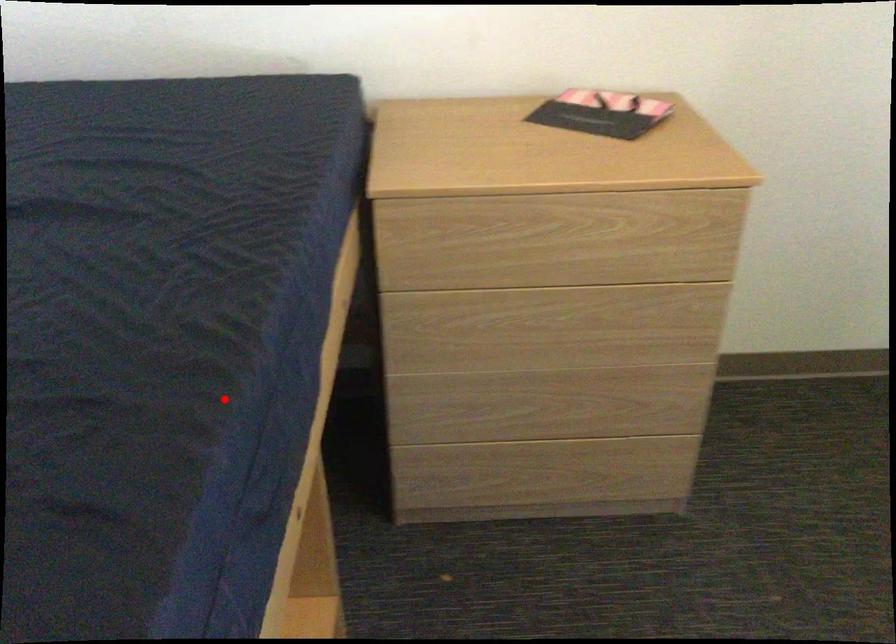
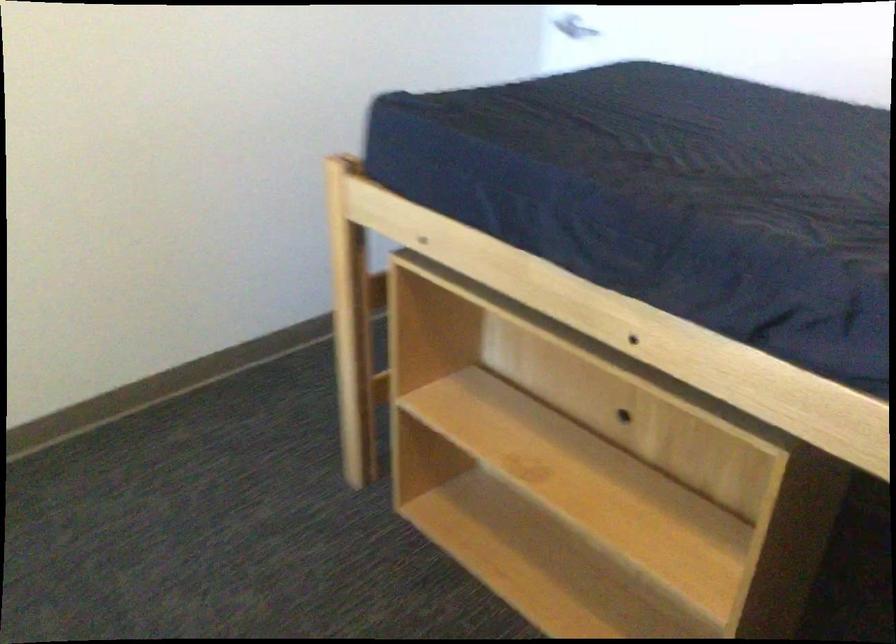
Question: I am providing you with two images of the same scene from different viewpoints. Image1 has a red point marked. In image2, the corresponding 3D location appears at what relative position? Reply with the corresponding letter.

Choices:
 (A) Closer
 (B) Farther

Answer: (B)